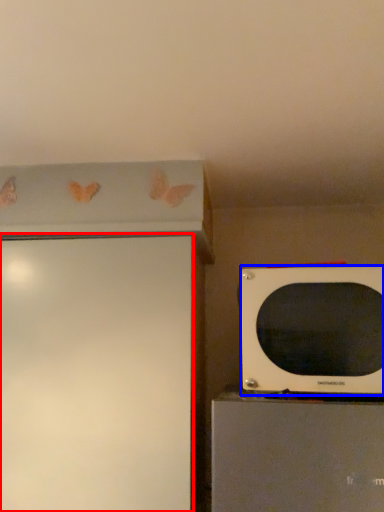
Question: Which of the following is the closest to the observer, screen door (highlighted by a red box) or microwave oven (highlighted by a blue box)?

Choices:
 (A) screen door
 (B) microwave oven

Answer: (B)